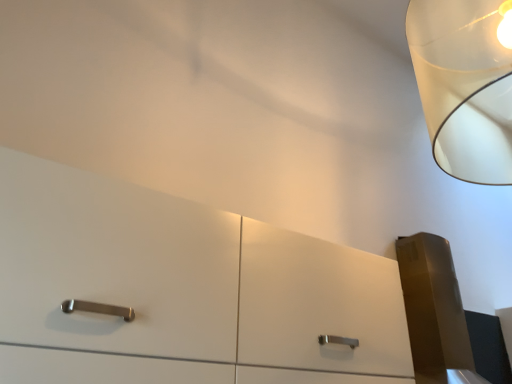
Question: Can you confirm if transparent plastic lampshade at upper right is smaller than white glossy dresser at center?

Choices:
 (A) no
 (B) yes

Answer: (B)

Question: Is transparent plastic lampshade at upper right outside of white glossy dresser at center?

Choices:
 (A) no
 (B) yes

Answer: (B)

Question: From a real-world perspective, is transparent plastic lampshade at upper right on top of white glossy dresser at center?

Choices:
 (A) yes
 (B) no

Answer: (A)

Question: Does transparent plastic lampshade at upper right have a greater height compared to white glossy dresser at center?

Choices:
 (A) no
 (B) yes

Answer: (B)

Question: Is the surface of transparent plastic lampshade at upper right in direct contact with white glossy dresser at center?

Choices:
 (A) yes
 (B) no

Answer: (B)

Question: Could you tell me if transparent plastic lampshade at upper right is facing white glossy dresser at center?

Choices:
 (A) no
 (B) yes

Answer: (A)

Question: Is white glossy dresser at center at the left side of transparent plastic lampshade at upper right?

Choices:
 (A) no
 (B) yes

Answer: (B)

Question: From a real-world perspective, is white glossy dresser at center on transparent plastic lampshade at upper right?

Choices:
 (A) yes
 (B) no

Answer: (B)

Question: Is white glossy dresser at center positioned far away from transparent plastic lampshade at upper right?

Choices:
 (A) yes
 (B) no

Answer: (A)

Question: From the image's perspective, is white glossy dresser at center beneath transparent plastic lampshade at upper right?

Choices:
 (A) yes
 (B) no

Answer: (A)

Question: Can you confirm if white glossy dresser at center is thinner than transparent plastic lampshade at upper right?

Choices:
 (A) yes
 (B) no

Answer: (A)

Question: Would you say white glossy dresser at center contains transparent plastic lampshade at upper right?

Choices:
 (A) no
 (B) yes

Answer: (A)

Question: Considering their positions, is white glossy dresser at center located in front of or behind transparent plastic lampshade at upper right?

Choices:
 (A) front
 (B) behind

Answer: (A)